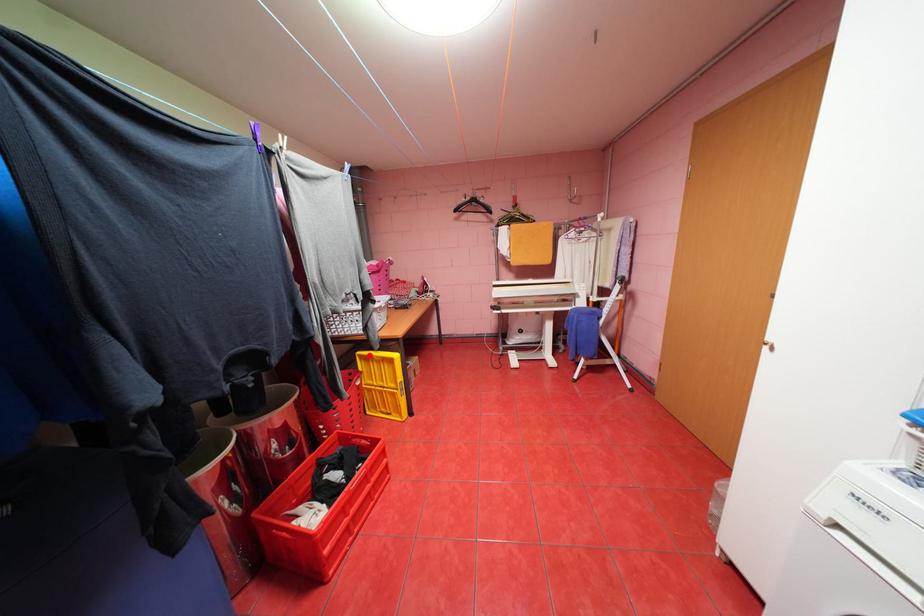
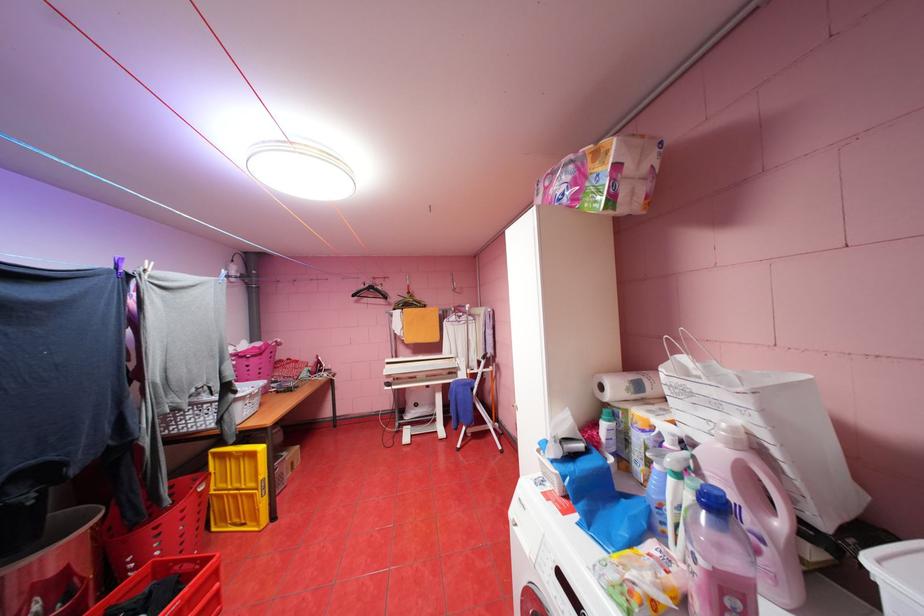
In the second image, find the point that corresponds to the highlighted location in the first image.

(224, 454)